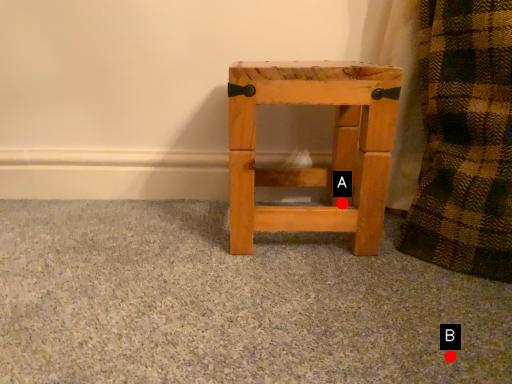
Question: Two points are circled on the image, labeled by A and B beside each circle. Which point is closer to the camera?

Choices:
 (A) A is closer
 (B) B is closer

Answer: (B)